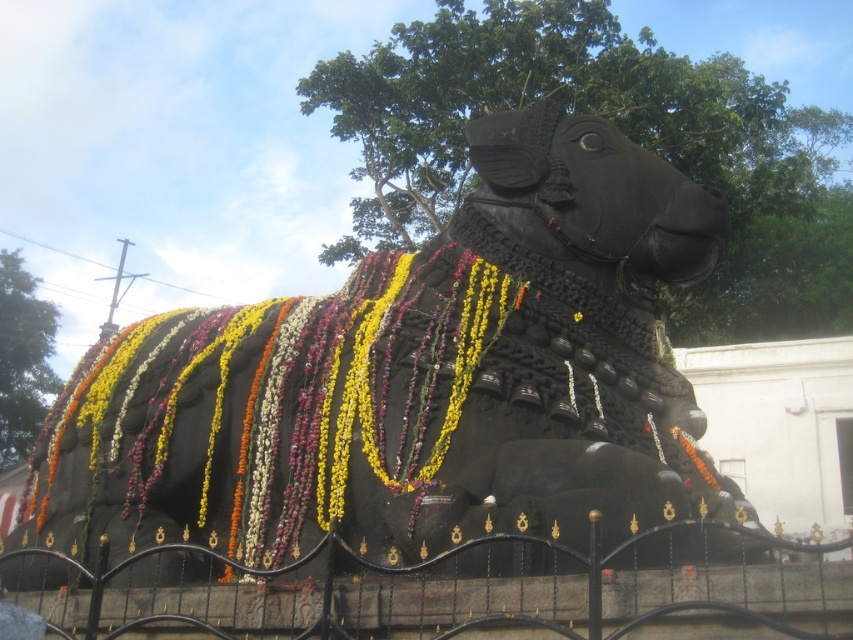
Is floral garland at center below black wrought iron fence at center?

No, floral garland at center is not below black wrought iron fence at center.

Between point (74, 376) and point (299, 560), which one is positioned in front?

Point (299, 560) is in front.

I want to click on floral garland at center, so click(273, 413).

Is black polished stone bull at center shorter than black wrought iron fence at center?

In fact, black polished stone bull at center may be taller than black wrought iron fence at center.

Based on the photo, who is lower down, black polished stone bull at center or black wrought iron fence at center?

black wrought iron fence at center is lower down.

Is point (329, 451) more distant than point (682, 588)?

That is True.

Find the location of a particular element. The image size is (853, 640). black polished stone bull at center is located at coordinates (413, 380).

Who is higher up, black polished stone bull at center or floral garland at center?

Positioned higher is black polished stone bull at center.

Does black polished stone bull at center appear under floral garland at center?

No.

Which is behind, point (199, 310) or point (372, 392)?

The point (199, 310) is behind.

Identify the location of black polished stone bull at center. The width and height of the screenshot is (853, 640). (413, 380).